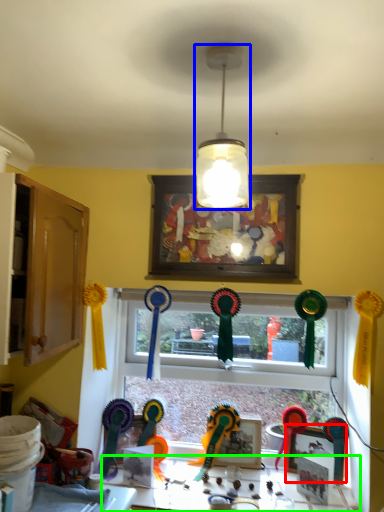
Question: Considering the real-world distances, which object is farthest from picture frame (highlighted by a red box)? lamp (highlighted by a blue box) or table (highlighted by a green box)?

Choices:
 (A) lamp
 (B) table

Answer: (A)